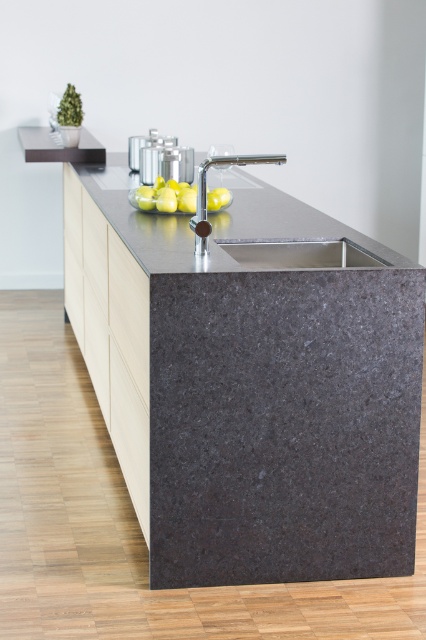
Question: Which point is closer to the camera?

Choices:
 (A) (187, 196)
 (B) (314, 260)

Answer: (B)

Question: Which point appears farthest from the camera in this image?

Choices:
 (A) (291, 260)
 (B) (215, 211)

Answer: (B)

Question: Does white glossy sink at center appear on the left side of yellow matte lemon at center?

Choices:
 (A) no
 (B) yes

Answer: (A)

Question: Can you confirm if white glossy sink at center is positioned below yellow matte lemon at center?

Choices:
 (A) no
 (B) yes

Answer: (B)

Question: Which point is closer to the camera?

Choices:
 (A) click(x=132, y=195)
 (B) click(x=354, y=250)

Answer: (B)

Question: Does white glossy sink at center appear on the right side of yellow matte lemon at center?

Choices:
 (A) no
 (B) yes

Answer: (B)